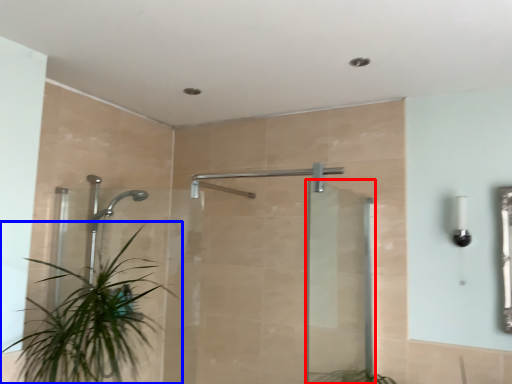
Question: Which of the following is the farthest to the observer, screen door (highlighted by a red box) or houseplant (highlighted by a blue box)?

Choices:
 (A) screen door
 (B) houseplant

Answer: (A)